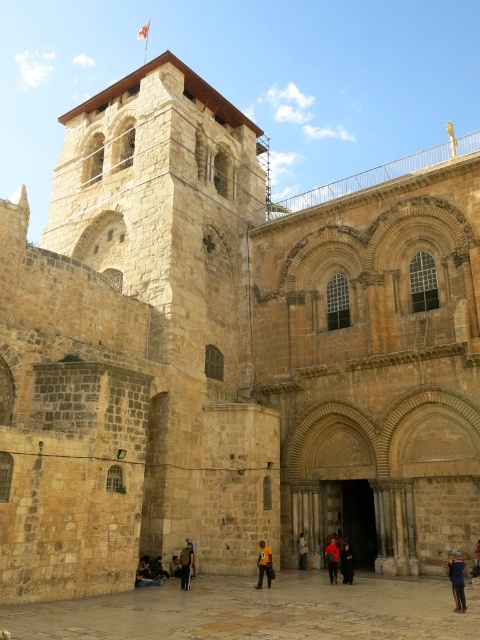
Between point (260, 579) and point (192, 552), which one is positioned behind?

Point (192, 552)

This screenshot has width=480, height=640. In order to click on yellow fabric at center in this screenshot , I will do `click(264, 564)`.

At what (x,y) coordinates should I click in order to perform the action: click on yellow fabric at center. Please return your answer as a coordinate pair (x, y). Image resolution: width=480 pixels, height=640 pixels. Looking at the image, I should click on (264, 564).

Is dark blue jacket at lower right behind dark red fabric at center?

No.

Who is more forward, (463, 592) or (347, 554)?

Point (463, 592) is in front.

Where is `dark blue jacket at lower right`? dark blue jacket at lower right is located at coordinates (456, 579).

Who is positioned more to the right, yellow fabric at center or dark red fabric at center?

Positioned to the right is dark red fabric at center.

Which is behind, point (264, 560) or point (349, 580)?

The point (349, 580) is more distant.

At what (x,y) coordinates should I click in order to perform the action: click on yellow fabric at center. Please return your answer as a coordinate pair (x, y). The width and height of the screenshot is (480, 640). Looking at the image, I should click on (264, 564).